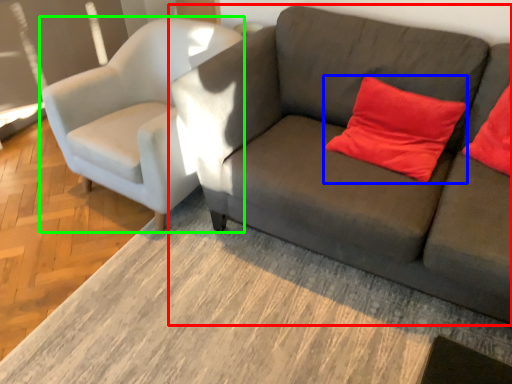
Question: Estimate the real-world distances between objects in this image. Which object is closer to studio couch (highlighted by a red box), pillow (highlighted by a blue box) or chair (highlighted by a green box)?

Choices:
 (A) pillow
 (B) chair

Answer: (A)